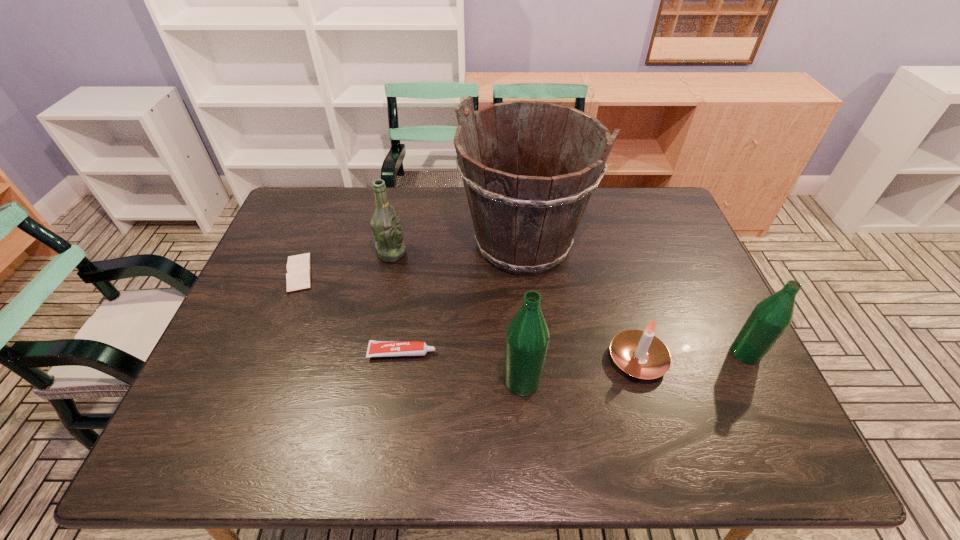
Please point out where to position a new bottle on the left to maintain spacing. Please provide its 2D coordinates. Your answer should be formatted as a tuple, i.e. [(x, y)], where the tuple contains the x and y coordinates of a point satisfying the conditions above.

[(275, 411)]